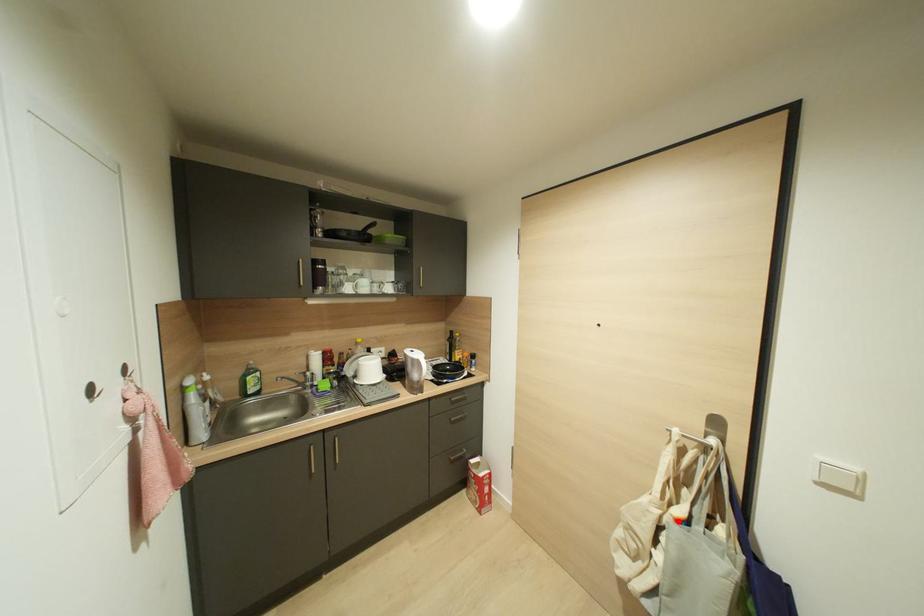
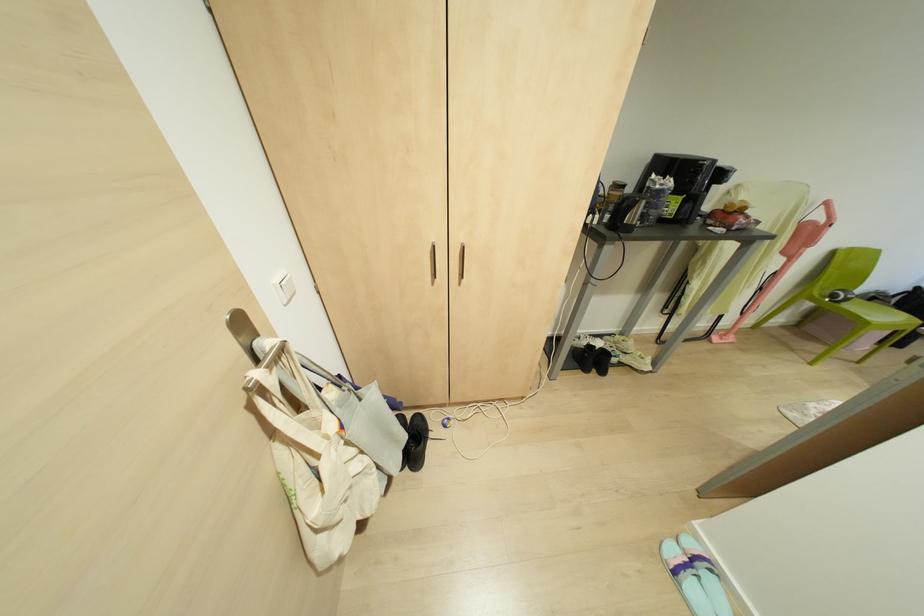
In the second image, find the point that corresponds to the highlighted location in the first image.

(342, 426)